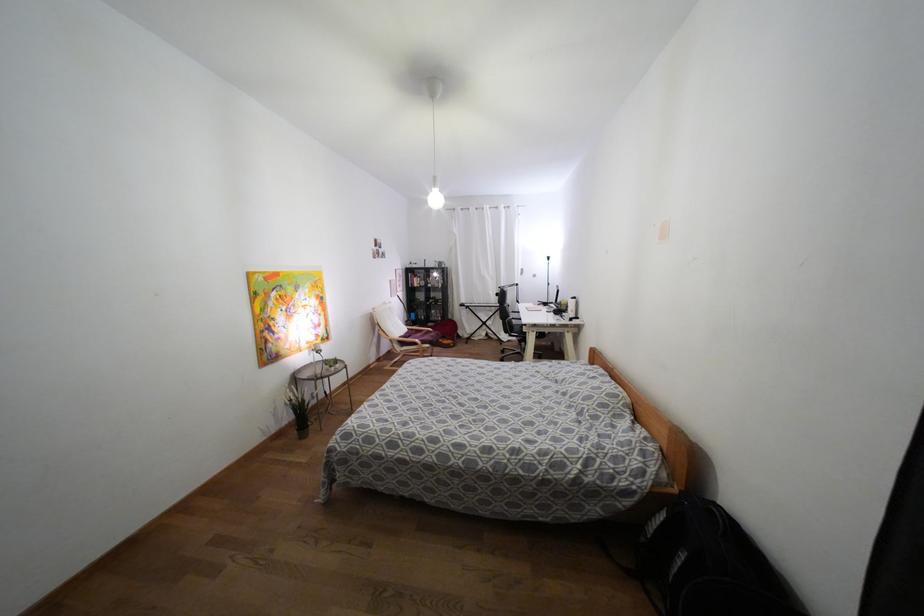
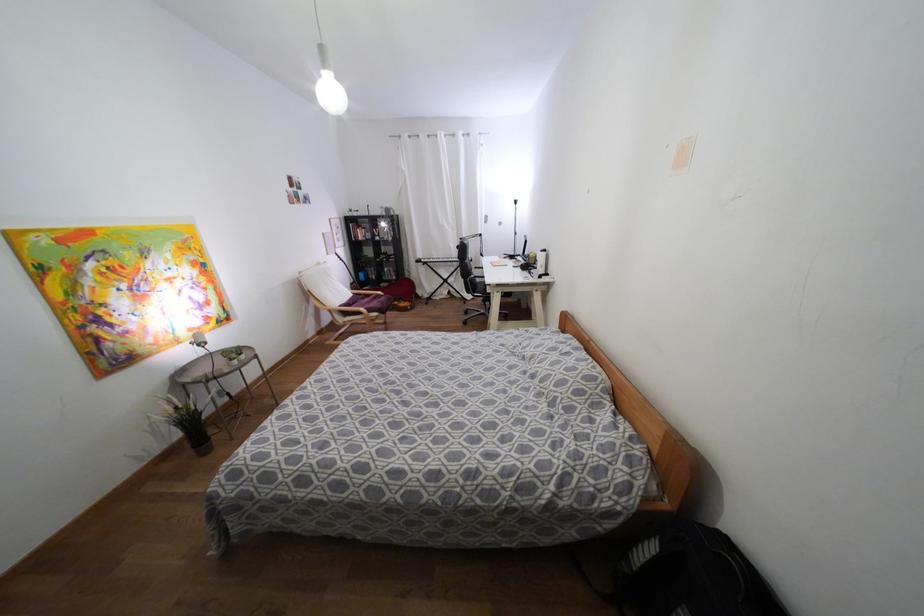
Locate, in the second image, the point that corresponds to pixel 432 334 in the first image.

(382, 299)